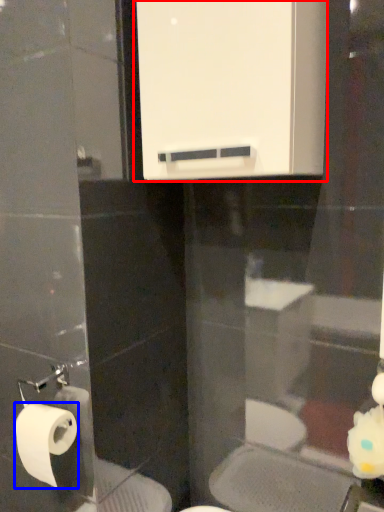
Question: Which object is closer to the camera taking this photo, medicine cabinet (highlighted by a red box) or toilet paper (highlighted by a blue box)?

Choices:
 (A) medicine cabinet
 (B) toilet paper

Answer: (A)